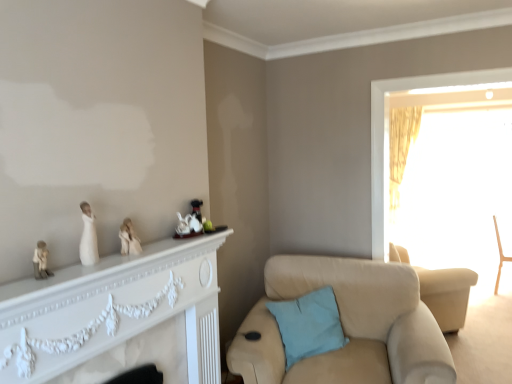
Question: Would you say wooden chair at right, positioned as the 2th chair in left-to-right order, is part of translucent yellow curtain at right's contents?

Choices:
 (A) yes
 (B) no

Answer: (B)

Question: Is translucent yellow curtain at right located outside wooden chair at right, marked as the 2th chair in a front-to-back arrangement?

Choices:
 (A) yes
 (B) no

Answer: (A)

Question: Is translucent yellow curtain at right positioned in front of wooden chair at right, placed as the 1th chair when sorted from right to left?

Choices:
 (A) yes
 (B) no

Answer: (A)

Question: Can you confirm if translucent yellow curtain at right is shorter than wooden chair at right, placed as the 1th chair when sorted from right to left?

Choices:
 (A) no
 (B) yes

Answer: (A)

Question: Can you confirm if translucent yellow curtain at right is smaller than wooden chair at right, positioned as the 2th chair in left-to-right order?

Choices:
 (A) yes
 (B) no

Answer: (B)

Question: From the image's perspective, does translucent yellow curtain at right appear lower than wooden chair at right, marked as the 2th chair in a front-to-back arrangement?

Choices:
 (A) no
 (B) yes

Answer: (A)

Question: Is translucent yellow curtain at right far from light blue fabric pillow at lower center?

Choices:
 (A) no
 (B) yes

Answer: (A)

Question: From a real-world perspective, is translucent yellow curtain at right below light blue fabric pillow at lower center?

Choices:
 (A) no
 (B) yes

Answer: (A)

Question: Can you confirm if translucent yellow curtain at right is taller than light blue fabric pillow at lower center?

Choices:
 (A) no
 (B) yes

Answer: (B)

Question: Can you confirm if translucent yellow curtain at right is smaller than light blue fabric pillow at lower center?

Choices:
 (A) no
 (B) yes

Answer: (A)

Question: From the image's perspective, does translucent yellow curtain at right appear lower than light blue fabric pillow at lower center?

Choices:
 (A) no
 (B) yes

Answer: (A)

Question: Is translucent yellow curtain at right bigger than light blue fabric pillow at lower center?

Choices:
 (A) yes
 (B) no

Answer: (A)

Question: From a real-world perspective, is matte black teapot at center, positioned as the first toy in back-to-front order, below wooden chair at right, placed as the 1th chair when sorted from right to left?

Choices:
 (A) yes
 (B) no

Answer: (B)